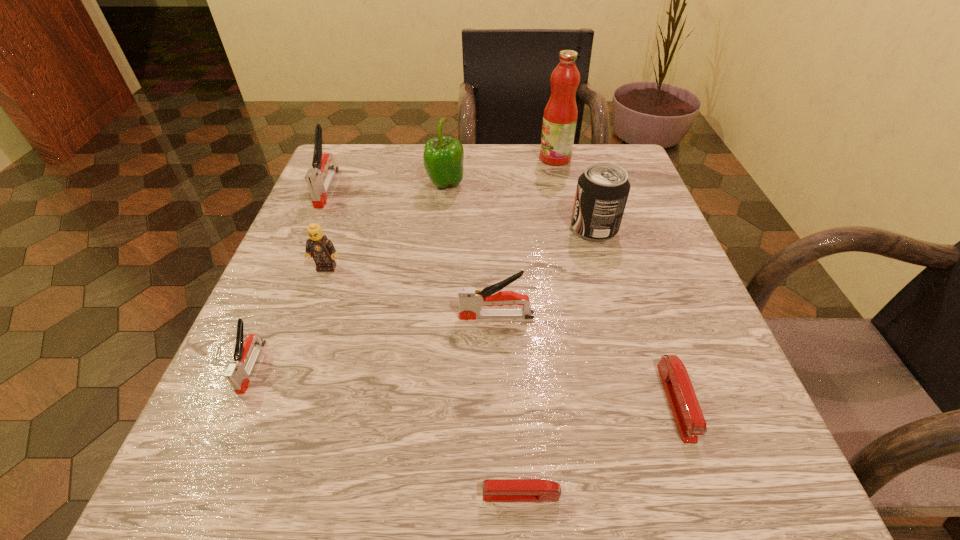
The width and height of the screenshot is (960, 540). Identify the location of tan Lego. (319, 247).

You are a GUI agent. You are given a task and a screenshot of the screen. Output one action in this format:
    pyautogui.click(x=<x>, y=<y>)
    Task: Click on the Lego
    This screenshot has width=960, height=540.
    Given the screenshot: What is the action you would take?
    [x=319, y=247]

The width and height of the screenshot is (960, 540). What are the coordinates of `the nearest gray stapler` in the screenshot? It's located at (238, 374).

Locate an element on the screen. The width and height of the screenshot is (960, 540). the third shortest stapler is located at coordinates (238, 374).

I want to click on the right red stapler, so tap(690, 421).

At what (x,y) coordinates should I click in order to perform the action: click on the second shortest object. Please return your answer as a coordinate pair (x, y). This screenshot has height=540, width=960. Looking at the image, I should click on (690, 421).

This screenshot has width=960, height=540. Find the location of `the shortest stapler`. the shortest stapler is located at coordinates (494, 490).

Identify the location of the nearest stapler. Image resolution: width=960 pixels, height=540 pixels. (494, 490).

Identify the location of vacant space located on the front label of the pink fruit juice. This screenshot has height=540, width=960. (398, 158).

Where is `blank space located on the front label of the pink fruit juice`? The height and width of the screenshot is (540, 960). blank space located on the front label of the pink fruit juice is located at coordinates (472, 158).